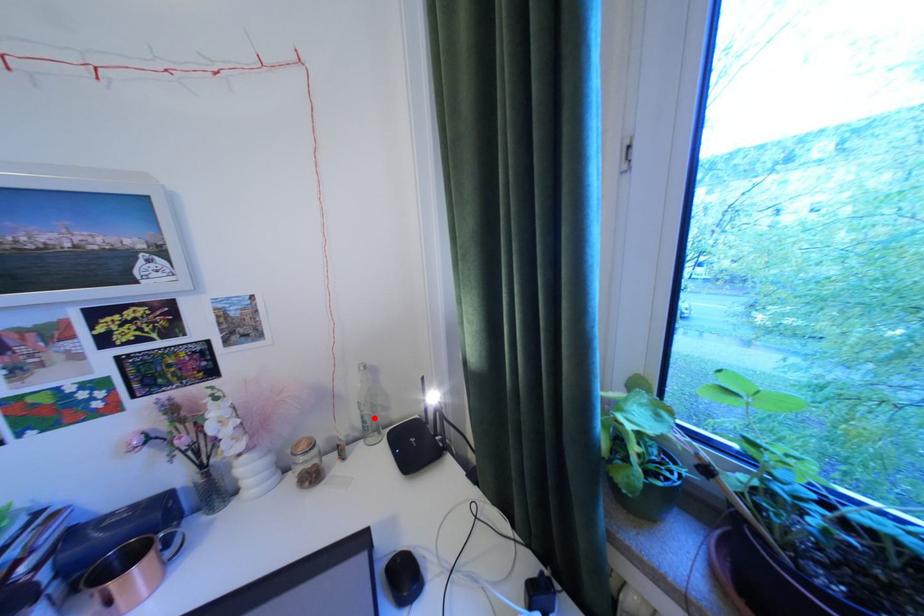
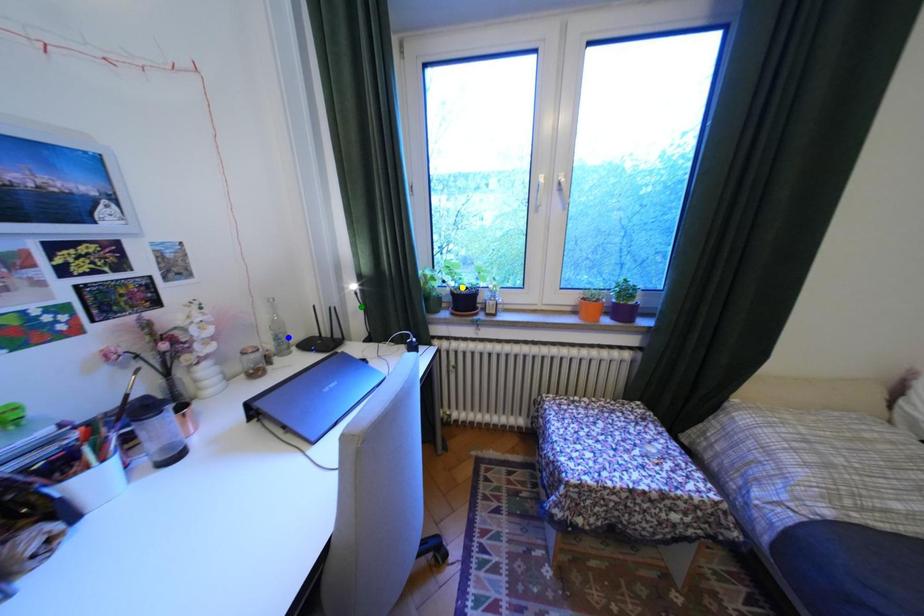
Question: I am providing you with two images of the same scene from different viewpoints. A red point is marked on the first image. You are given multiple points on the second image. Can you choose the point in image 2 that corresponds to the point in image 1?

Choices:
 (A) blue point
 (B) yellow point
 (C) green point

Answer: (A)